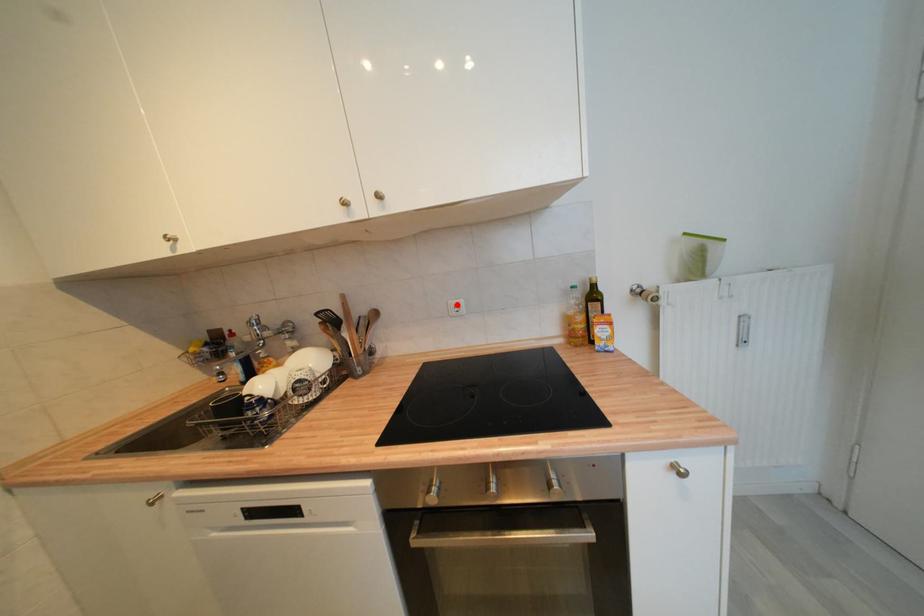
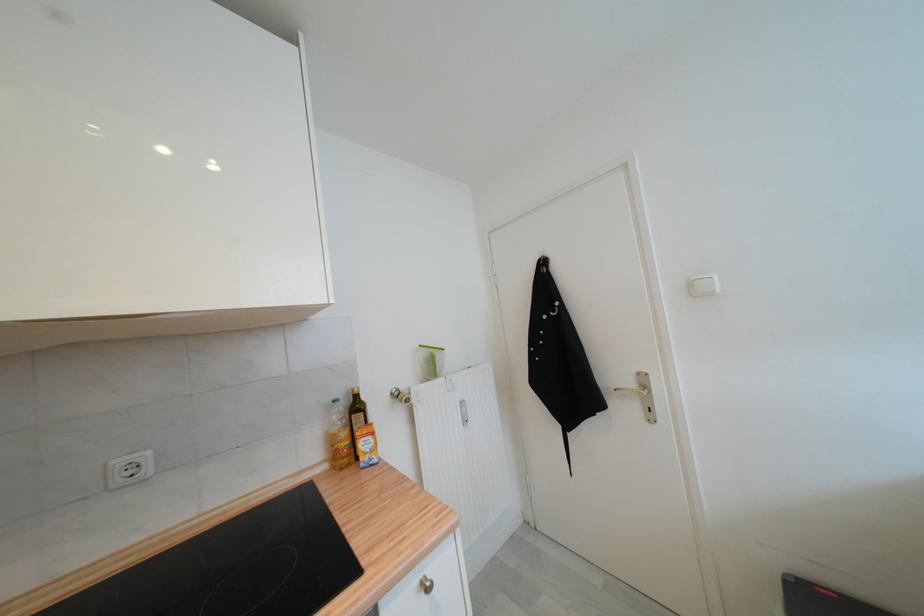
Find the pixel in the second image that matches the highlighted location in the first image.

(126, 464)